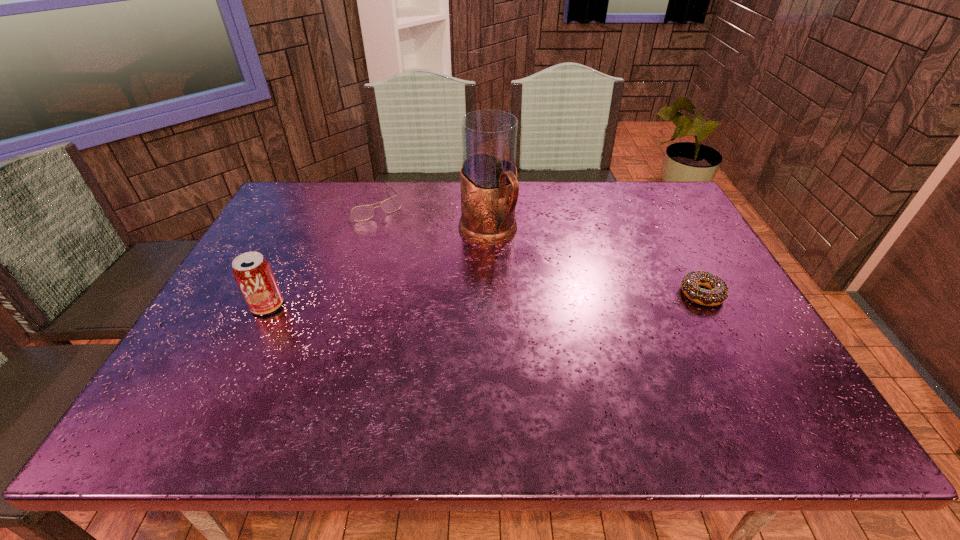
Find the location of a particular element. Image resolution: width=960 pixels, height=540 pixels. vacant area between the doughnut and the pitcher is located at coordinates (595, 263).

Find the location of `vacant space that is in between the pitcher and the rightmost object`. vacant space that is in between the pitcher and the rightmost object is located at coordinates (595, 263).

At what (x,y) coordinates should I click in order to perform the action: click on vacant area that lies between the doughnut and the tallest object. Please return your answer as a coordinate pair (x, y). The image size is (960, 540). Looking at the image, I should click on (595, 263).

Locate an element on the screen. free space between the second object from right to left and the shortest object is located at coordinates (595, 263).

This screenshot has height=540, width=960. I want to click on free space between the second tallest object and the second shortest object, so click(319, 255).

At what (x,y) coordinates should I click in order to perform the action: click on object that is the third closest to the leftmost object. Please return your answer as a coordinate pair (x, y). This screenshot has width=960, height=540. Looking at the image, I should click on (690, 283).

Point out which object is positioned as the second nearest to the second shortest object. Please provide its 2D coordinates. Your answer should be formatted as a tuple, i.e. [(x, y)], where the tuple contains the x and y coordinates of a point satisfying the conditions above.

[(253, 274)]

The height and width of the screenshot is (540, 960). In order to click on free spot that satisfies the following two spatial constraints: 1. on the back side of the leftmost object; 2. on the left side of the second shortest object in this screenshot , I will do `click(318, 204)`.